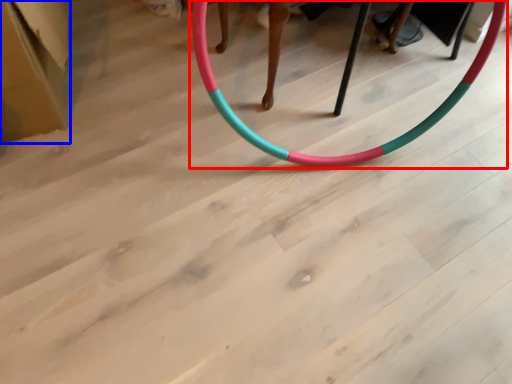
Question: Which of the following is the closest to the observer, toy (highlighted by a red box) or cardboard box (highlighted by a blue box)?

Choices:
 (A) toy
 (B) cardboard box

Answer: (A)